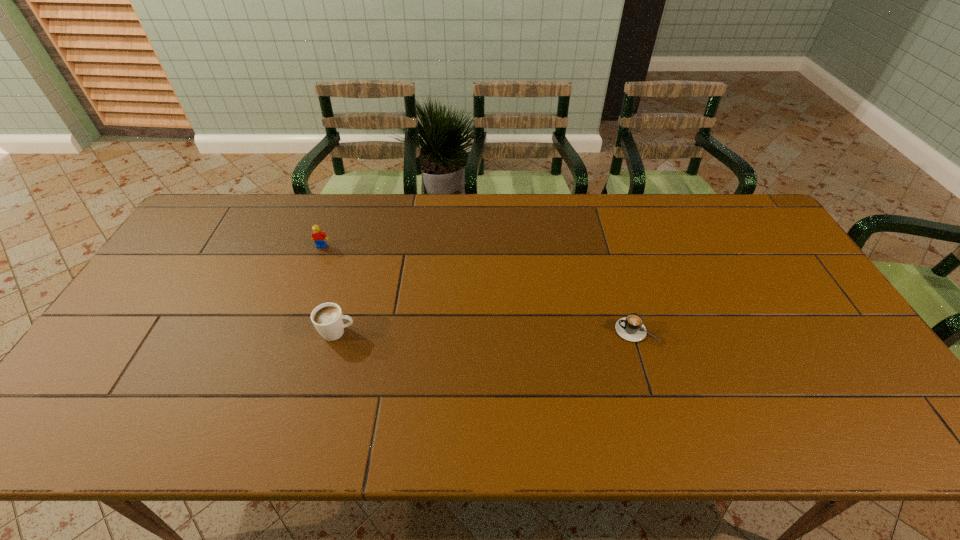
You are a GUI agent. You are given a task and a screenshot of the screen. Output one action in this format:
    pyautogui.click(x=<x>, y=<y>)
    Task: Click on the farthest object
    This screenshot has height=540, width=960.
    Given the screenshot: What is the action you would take?
    pyautogui.click(x=319, y=237)

At what (x,y) coordinates should I click in order to perform the action: click on Lego. Please return your answer as a coordinate pair (x, y). Looking at the image, I should click on (319, 237).

The height and width of the screenshot is (540, 960). I want to click on the second object from left to right, so click(328, 319).

The height and width of the screenshot is (540, 960). Identify the location of the taller cappuccino. (328, 319).

The image size is (960, 540). In order to click on the right cappuccino in this screenshot , I will do `click(631, 328)`.

You are a GUI agent. You are given a task and a screenshot of the screen. Output one action in this format:
    pyautogui.click(x=<x>, y=<y>)
    Task: Click on the shorter cappuccino
    
    Given the screenshot: What is the action you would take?
    pyautogui.click(x=631, y=328)

Where is `vacant space located 0.130m on the face of the farthest object`? This screenshot has height=540, width=960. vacant space located 0.130m on the face of the farthest object is located at coordinates (310, 278).

Locate an element on the screen. free location located 0.370m with the handle on the side of the second object from left to right is located at coordinates (496, 332).

Identify the location of vacant region located 0.370m with the handle on the side of the shortest object. (475, 330).

This screenshot has width=960, height=540. Find the location of `free region located 0.130m with the handle on the side of the shortest object`. free region located 0.130m with the handle on the side of the shortest object is located at coordinates (566, 330).